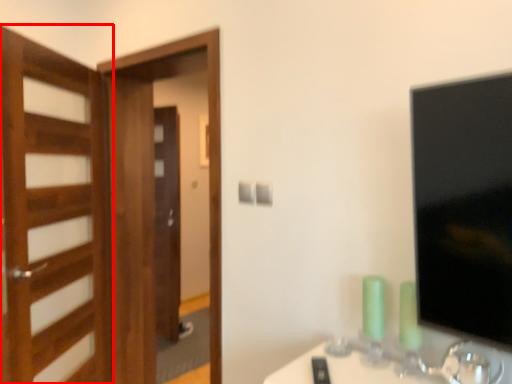
Question: From the image, what is the correct spatial relationship of door (annotated by the red box) in relation to screen door?

Choices:
 (A) left
 (B) right

Answer: (A)